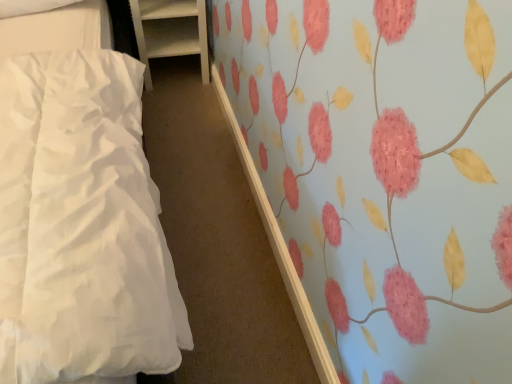
Question: Considering the relative positions of white satin bed at left and white wood shelf at upper left in the image provided, is white satin bed at left to the right of white wood shelf at upper left from the viewer's perspective?

Choices:
 (A) yes
 (B) no

Answer: (B)

Question: Is white wood shelf at upper left at the back of white satin bed at left?

Choices:
 (A) yes
 (B) no

Answer: (B)

Question: Is the depth of white satin bed at left greater than that of white wood shelf at upper left?

Choices:
 (A) no
 (B) yes

Answer: (A)

Question: From the image's perspective, is white satin bed at left located above white wood shelf at upper left?

Choices:
 (A) no
 (B) yes

Answer: (A)

Question: Is white satin bed at left at the left side of white wood shelf at upper left?

Choices:
 (A) no
 (B) yes

Answer: (B)

Question: Is white satin bed at left positioned in front of white wood shelf at upper left?

Choices:
 (A) yes
 (B) no

Answer: (A)

Question: Is white wood shelf at upper left touching white satin bed at left?

Choices:
 (A) no
 (B) yes

Answer: (A)

Question: Is white wood shelf at upper left to the left of white satin bed at left from the viewer's perspective?

Choices:
 (A) no
 (B) yes

Answer: (A)

Question: Can you confirm if white wood shelf at upper left is taller than white satin bed at left?

Choices:
 (A) no
 (B) yes

Answer: (B)

Question: Is white wood shelf at upper left facing towards white satin bed at left?

Choices:
 (A) yes
 (B) no

Answer: (A)

Question: Is white wood shelf at upper left completely or partially outside of white satin bed at left?

Choices:
 (A) yes
 (B) no

Answer: (A)

Question: Can you confirm if white wood shelf at upper left is shorter than white satin bed at left?

Choices:
 (A) no
 (B) yes

Answer: (A)

Question: Considering the positions of white satin bed at left and white wood shelf at upper left in the image, is white satin bed at left wider or thinner than white wood shelf at upper left?

Choices:
 (A) wide
 (B) thin

Answer: (A)